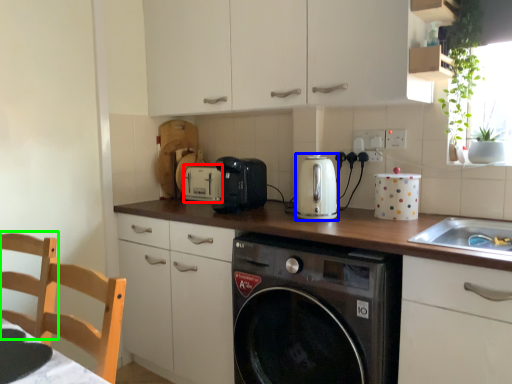
Question: Estimate the real-world distances between objects in this image. Which object is farther from appliance (highlighted by a red box), kitchen appliance (highlighted by a blue box) or chair (highlighted by a green box)?

Choices:
 (A) kitchen appliance
 (B) chair

Answer: (B)